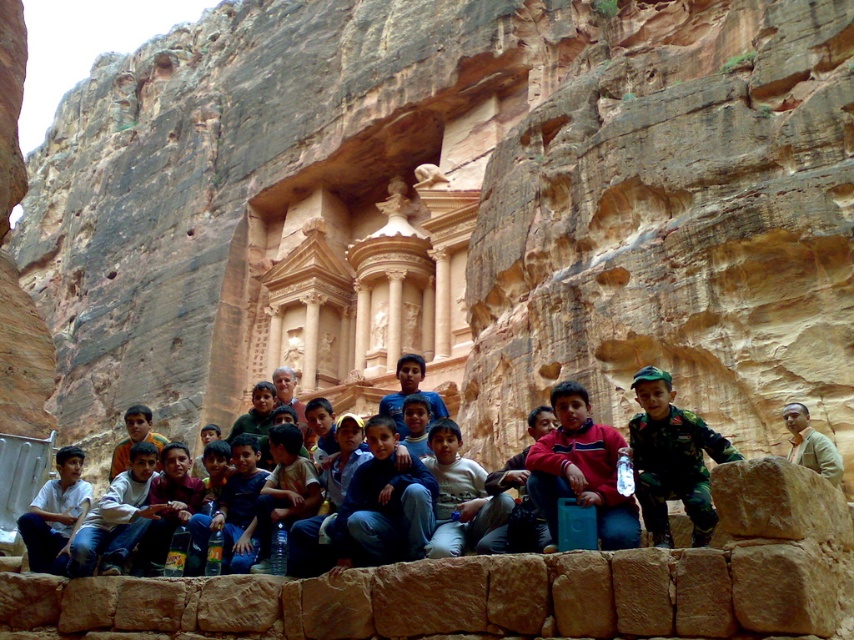
Question: Is red fleece jacket at center above light brown leather jacket at center?

Choices:
 (A) no
 (B) yes

Answer: (B)

Question: From the image, what is the correct spatial relationship of camouflage uniform at center in relation to light brown leather jacket at center?

Choices:
 (A) right
 (B) left

Answer: (B)

Question: Which of these objects is positioned closest to the red fleece jacket at center?

Choices:
 (A) camouflage uniform at center
 (B) light brown leather jacket at center

Answer: (A)

Question: Can you confirm if camouflage uniform at center is bigger than light brown leather jacket at center?

Choices:
 (A) no
 (B) yes

Answer: (B)

Question: Which of the following is the farthest from the observer?

Choices:
 (A) (559, 433)
 (B) (670, 426)
 (C) (829, 474)

Answer: (C)

Question: Which point appears farthest from the camera in this image?

Choices:
 (A) (686, 460)
 (B) (790, 422)

Answer: (B)